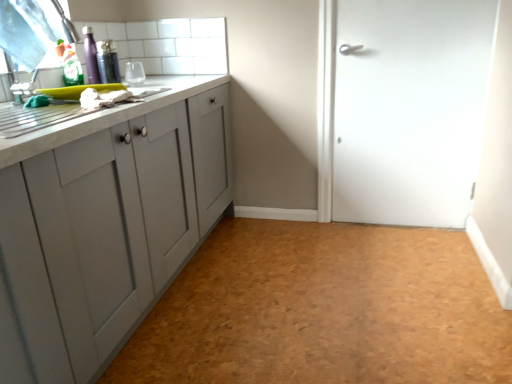
The height and width of the screenshot is (384, 512). In order to click on vacant area that lies in front of white matte door at right in this screenshot , I will do `click(406, 259)`.